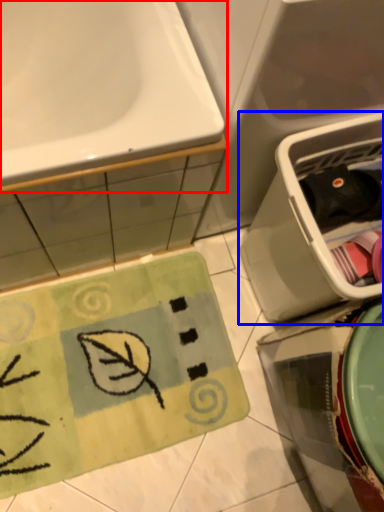
Question: Which object is further to the camera taking this photo, sink (highlighted by a red box) or dish washer (highlighted by a blue box)?

Choices:
 (A) sink
 (B) dish washer

Answer: (B)